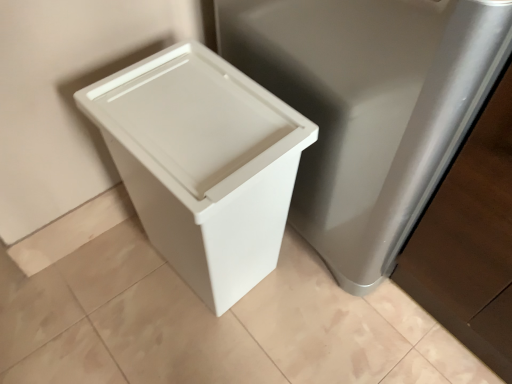
Locate an element on the screen. vacant area to the right of beige wood baseboard at lower left is located at coordinates (131, 260).